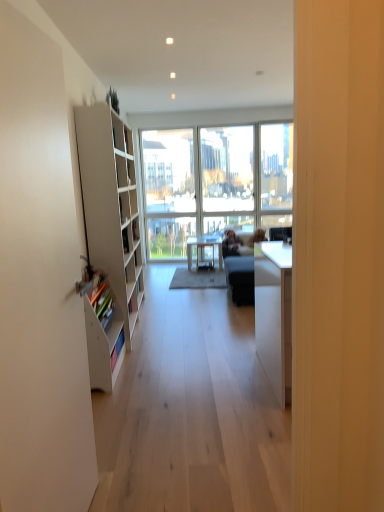
Question: Is the position of matte white table at center less distant than that of white matte bookshelf at left?

Choices:
 (A) yes
 (B) no

Answer: (B)

Question: Is matte white table at center wider than white matte bookshelf at left?

Choices:
 (A) yes
 (B) no

Answer: (A)

Question: Considering the relative sizes of matte white table at center and white matte bookshelf at left in the image provided, is matte white table at center thinner than white matte bookshelf at left?

Choices:
 (A) no
 (B) yes

Answer: (A)

Question: Does matte white table at center come behind white matte bookshelf at left?

Choices:
 (A) no
 (B) yes

Answer: (B)

Question: Considering the relative sizes of matte white table at center and white matte bookshelf at left in the image provided, is matte white table at center taller than white matte bookshelf at left?

Choices:
 (A) no
 (B) yes

Answer: (A)

Question: From their relative heights in the image, would you say matte white table at center is taller or shorter than transparent glass window at center?

Choices:
 (A) tall
 (B) short

Answer: (B)

Question: Choose the correct answer: Is matte white table at center inside transparent glass window at center or outside it?

Choices:
 (A) inside
 (B) outside

Answer: (B)

Question: From the image's perspective, is matte white table at center above or below transparent glass window at center?

Choices:
 (A) above
 (B) below

Answer: (B)

Question: Considering the positions of point [x=187, y=244] and point [x=215, y=136], is point [x=187, y=244] closer or farther from the camera than point [x=215, y=136]?

Choices:
 (A) farther
 (B) closer

Answer: (B)

Question: Choose the correct answer: Is white matte cabinet at left inside transparent glass window at center or outside it?

Choices:
 (A) inside
 (B) outside

Answer: (B)

Question: Considering their positions, is white matte cabinet at left located in front of or behind transparent glass window at center?

Choices:
 (A) front
 (B) behind

Answer: (A)

Question: Considering the positions of white matte cabinet at left and transparent glass window at center in the image, is white matte cabinet at left taller or shorter than transparent glass window at center?

Choices:
 (A) short
 (B) tall

Answer: (A)

Question: From a real-world perspective, is white matte cabinet at left above or below transparent glass window at center?

Choices:
 (A) below
 (B) above

Answer: (A)

Question: Choose the correct answer: Is white matte bookshelf at left inside transparent glass window at center or outside it?

Choices:
 (A) inside
 (B) outside

Answer: (B)

Question: Is white matte bookshelf at left in front of or behind transparent glass window at center in the image?

Choices:
 (A) front
 (B) behind

Answer: (A)